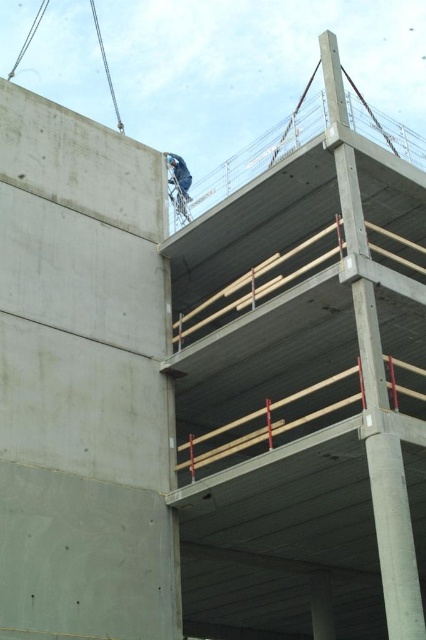
From the picture: You are a safety inspector assessing the construction site. You notice the smooth concrete at upper left and the blue fabric construction worker at upper center. Which object is higher in elevation?

The smooth concrete at upper left is taller than the blue fabric construction worker at upper center, so the smooth concrete at upper left is higher in elevation.

You are a delivery drone carrying a package that requires a landing zone at least 30 meters away from the smooth concrete at upper left. Can you safely land your drone on the construction site?

The distance between the drone and the smooth concrete at upper left is 33.55 meters, which exceeds the minimum requirement of 30 meters. Therefore, the drone can safely land on the construction site.

You are a safety inspector standing at the entrance of the construction site. You need to check two points on the upper level structure for safety hazards. The points are labeled as point 1 at coordinates (143, 637) and point 2 at coordinates (164, 156). Which point should you inspect first if you want to check the nearest one from your current position?

Point 1 at coordinates (143, 637) is closer to the viewer, so you should inspect it first.